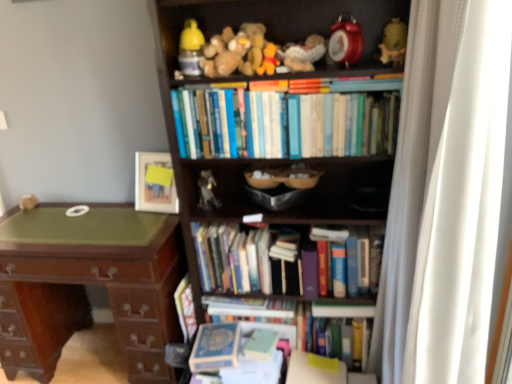
What are the coordinates of `free space in front of matte wooden picture frame at upper center` in the screenshot? It's located at (150, 219).